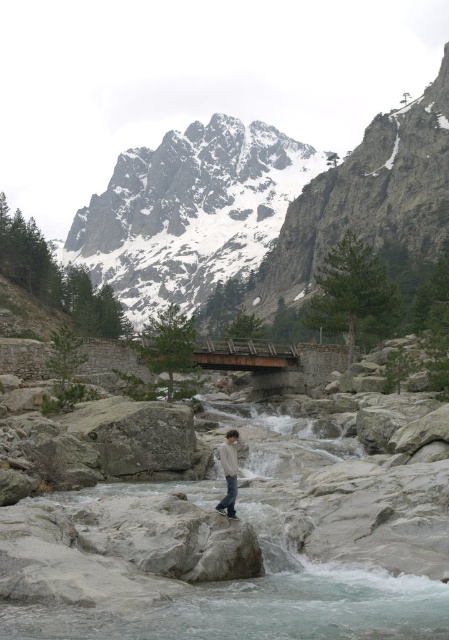
Question: Does snowy granite mountain at upper center appear on the left side of light gray sweater at center?

Choices:
 (A) no
 (B) yes

Answer: (B)

Question: Is the position of snowy granite mountain at upper center more distant than that of light gray sweater at center?

Choices:
 (A) yes
 (B) no

Answer: (A)

Question: Is snowy granite mountain at upper center positioned in front of light gray sweater at center?

Choices:
 (A) yes
 (B) no

Answer: (B)

Question: Which object appears farthest from the camera in this image?

Choices:
 (A) light gray sweater at center
 (B) snowy granite mountain at upper center

Answer: (B)

Question: Which object appears closest to the camera in this image?

Choices:
 (A) snowy granite mountain at upper center
 (B) light gray sweater at center

Answer: (B)